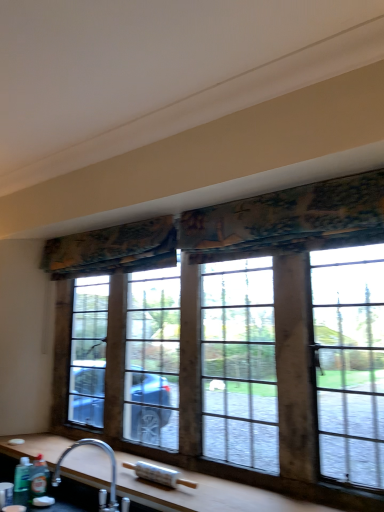
Locate an element on the screen. Image resolution: width=384 pixels, height=512 pixels. vacant area on top of textured fabric curtain at upper center, which appears as the second curtain when viewed from the right (from a real-world perspective) is located at coordinates (96, 228).